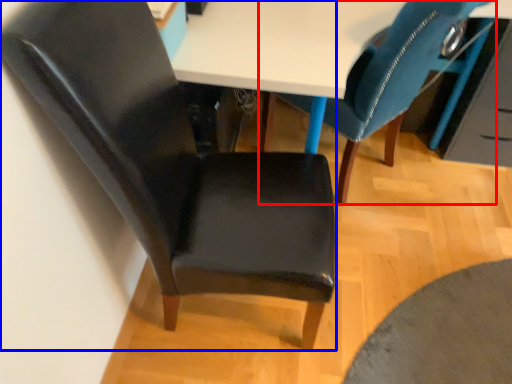
Question: Which point is closer to the camera, chair (highlighted by a red box) or chair (highlighted by a blue box)?

Choices:
 (A) chair
 (B) chair

Answer: (B)